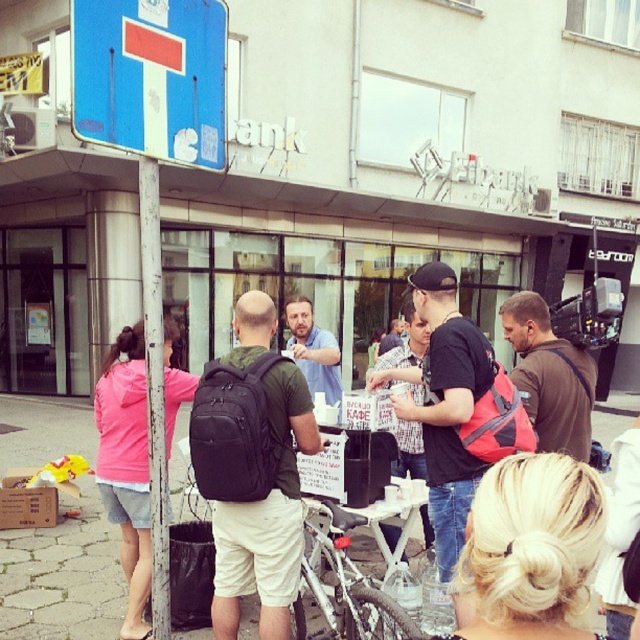
Can you confirm if blue painted metal sign at upper left is positioned below plaid shirt at center?

Incorrect, blue painted metal sign at upper left is not positioned below plaid shirt at center.

Between blue painted metal sign at upper left and plaid shirt at center, which one is positioned higher?

Positioned higher is blue painted metal sign at upper left.

Identify the location of blue painted metal sign at upper left. (150, 77).

From the picture: Can you confirm if black matte backpack at center is wider than matte blue shirt at center?

Yes, black matte backpack at center is wider than matte blue shirt at center.

Between black matte backpack at center and matte blue shirt at center, which one has more height?

black matte backpack at center is taller.

Find the location of `black matte backpack at center`. black matte backpack at center is located at coordinates (266, 515).

Is matte black backpack at center thinner than matte blue shirt at center?

Incorrect, matte black backpack at center's width is not less than matte blue shirt at center's.

What do you see at coordinates (444, 404) in the screenshot? The image size is (640, 640). I see `matte black backpack at center` at bounding box center [444, 404].

Locate an element on the screen. matte black backpack at center is located at coordinates (444, 404).